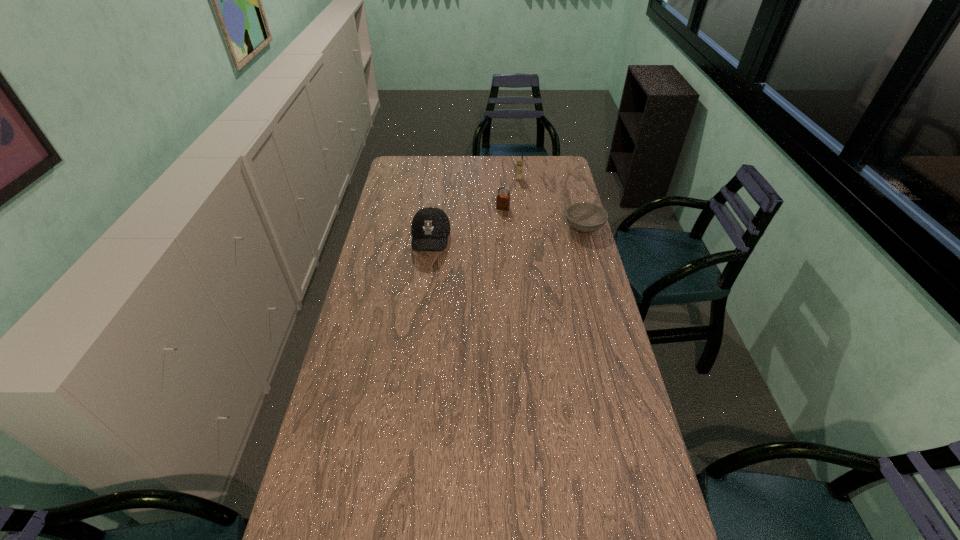
The height and width of the screenshot is (540, 960). I want to click on vacant space located 0.150m on the front of the tallest object, where the keypad is located, so click(x=518, y=198).

Identify the location of free space located 0.360m on the front of the tallest object, where the keypad is located. (518, 226).

Locate an element on the screen. The image size is (960, 540). vacant space located on the front-facing side of the second farthest object is located at coordinates (486, 244).

Identify the location of free space located 0.320m on the front-facing side of the second farthest object. This screenshot has height=540, width=960. (480, 256).

The height and width of the screenshot is (540, 960). I want to click on free space located on the front-facing side of the second farthest object, so click(484, 247).

Identify the location of object present at the far edge. The height and width of the screenshot is (540, 960). (519, 166).

You are a GUI agent. You are given a task and a screenshot of the screen. Output one action in this format:
    pyautogui.click(x=<x>, y=<y>)
    Task: Click on the object located in the left edge section of the desktop
    Image resolution: width=960 pixels, height=540 pixels.
    Given the screenshot: What is the action you would take?
    pyautogui.click(x=430, y=228)

You are a GUI agent. You are given a task and a screenshot of the screen. Output one action in this format:
    pyautogui.click(x=<x>, y=<y>)
    Task: Click on the object situated at the right edge
    Image resolution: width=960 pixels, height=540 pixels.
    Given the screenshot: What is the action you would take?
    pyautogui.click(x=586, y=217)

Locate an element on the screen. vacant space at the far edge of the desktop is located at coordinates (470, 158).

You are a GUI agent. You are given a task and a screenshot of the screen. Output one action in this format:
    pyautogui.click(x=<x>, y=<y>)
    Task: Click on the free space at the left edge of the desktop
    The height and width of the screenshot is (540, 960).
    Given the screenshot: What is the action you would take?
    pyautogui.click(x=396, y=307)